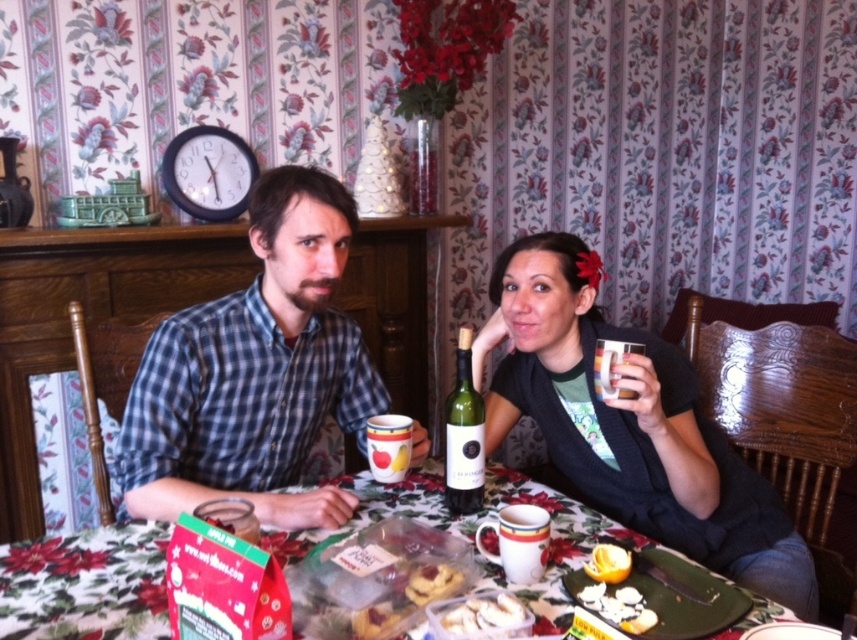
Question: Does green matte wine bottle at center lie behind golden brown crumbly pastry at table center?

Choices:
 (A) yes
 (B) no

Answer: (A)

Question: Which is nearer to the golden brown crumbly pastry at table center?

Choices:
 (A) blue checkered shirt at center
 (B) white crumbly pastry at lower center
 (C) checkered fabric shirt at left

Answer: (B)

Question: Estimate the real-world distances between objects in this image. Which object is closer to the floral-patterned tablecloth at center?

Choices:
 (A) matte black sweater at center
 (B) white crumbly pastry at lower center
 (C) green matte wine bottle at center
 (D) white crumbly cookies at lower center

Answer: (C)

Question: Is checkered fabric shirt at left further to the viewer compared to matte black sweater at center?

Choices:
 (A) no
 (B) yes

Answer: (B)

Question: Does blue checkered shirt at center appear over floral-patterned tablecloth at center?

Choices:
 (A) yes
 (B) no

Answer: (A)

Question: Which object appears farthest from the camera in this image?

Choices:
 (A) white crumbly cookies at lower center
 (B) blue checkered shirt at center

Answer: (B)